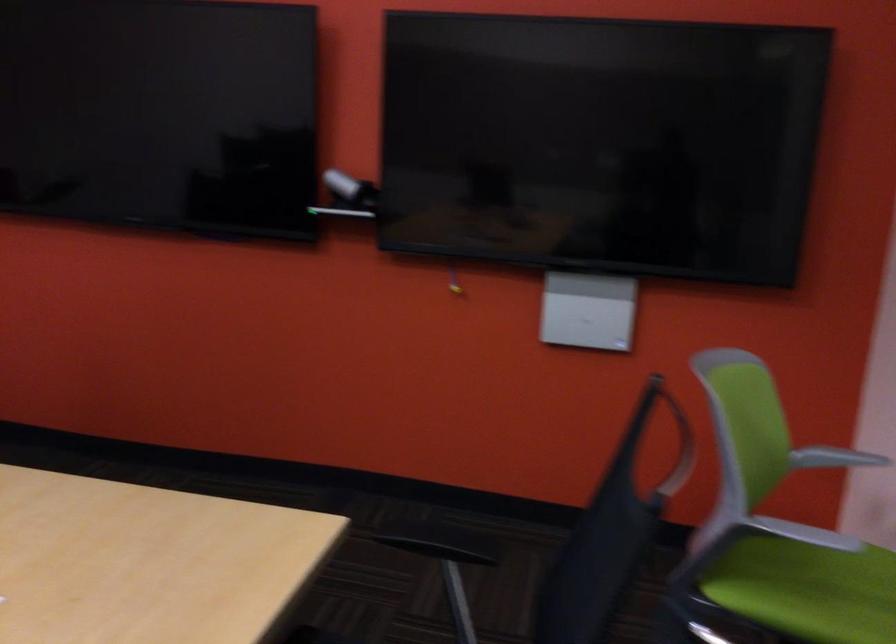
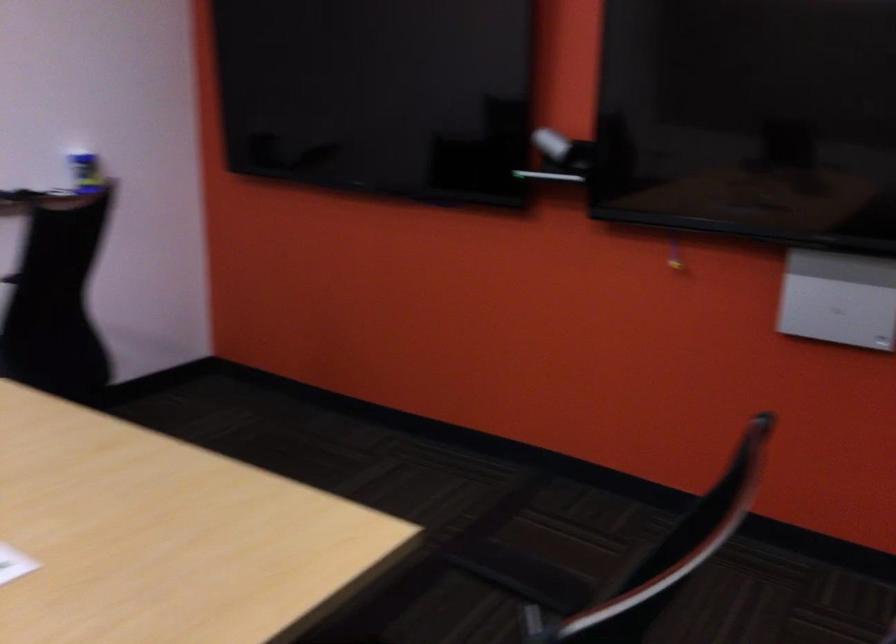
What movement of the cameraman would produce the second image?

The cameraman moved toward right, forward.